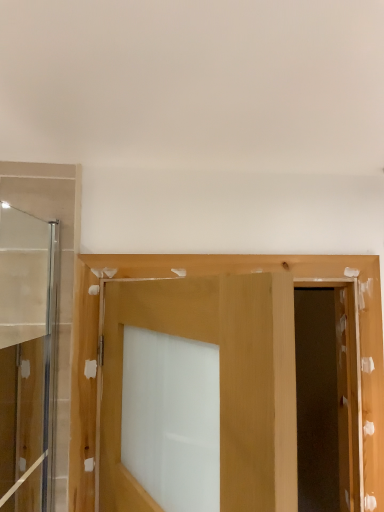
This screenshot has width=384, height=512. Identify the location of matte wood door at center. (220, 382).

In the scene shown: What is the approximate width of matte wood door at center?

matte wood door at center is 4.78 inches wide.

What do you see at coordinates (220, 382) in the screenshot? I see `matte wood door at center` at bounding box center [220, 382].

This screenshot has height=512, width=384. What are the coordinates of `matte wood door at center` in the screenshot? It's located at tap(220, 382).